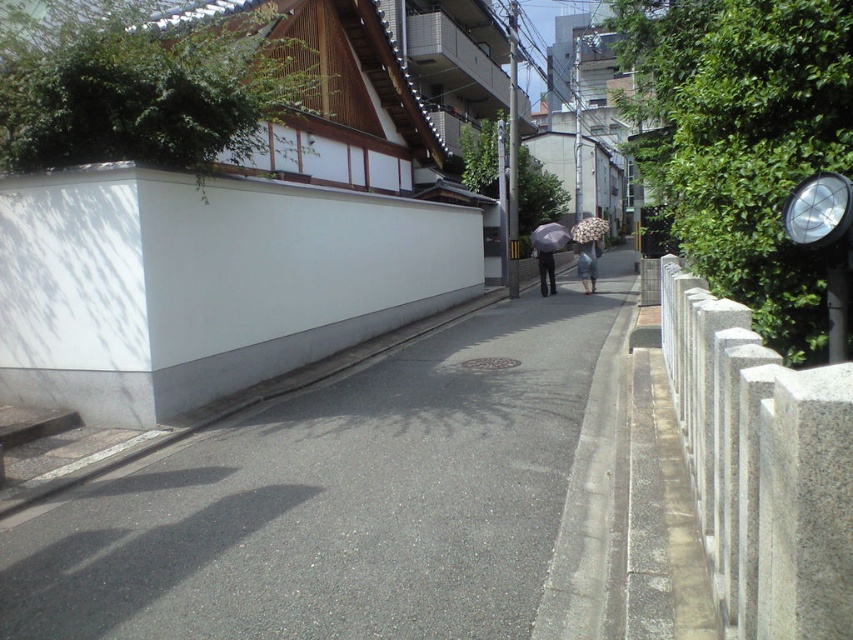
You are a delivery person carrying a package that requires a 36 inch clearance to maneuver safely. You need to pass through the space between the transparent fabric umbrella at center and the dark gray pants at center. Can you safely navigate this space with your package?

The distance between the transparent fabric umbrella at center and the dark gray pants at center is 36.59 inches, which is slightly more than the required 36 inch clearance. Therefore, you can safely navigate the space with your package.